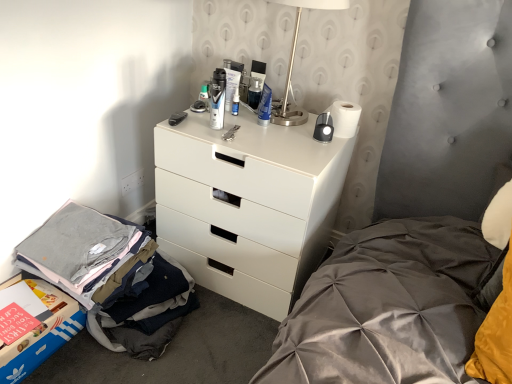
At what (x,y) coordinates should I click in order to perform the action: click on vacant space to the right of blue plastic tube at center, positioned as the 5th toiletry in left-to-right order. Please return your answer as a coordinate pair (x, y). The image size is (512, 384). Looking at the image, I should click on (295, 129).